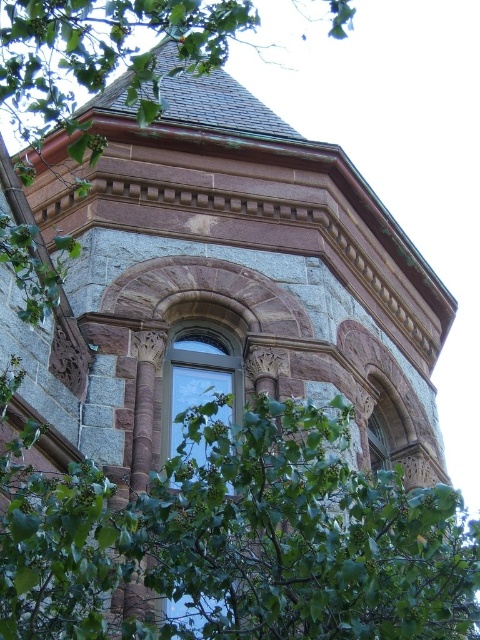
Does green leafy tree at center have a lesser width compared to clear glass window at center?

Incorrect, green leafy tree at center's width is not less than clear glass window at center's.

Between point (40, 496) and point (222, 388), which one is positioned in front?

Point (40, 496)

At what (x,y) coordinates should I click in order to perform the action: click on green leafy tree at center. Please return your answer as a coordinate pair (x, y). Looking at the image, I should click on (240, 540).